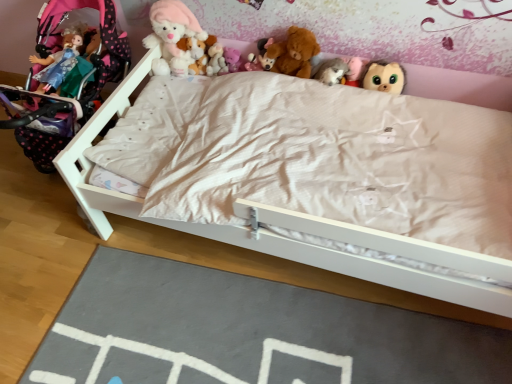
The width and height of the screenshot is (512, 384). I want to click on vacant point above slate at lower center (from a real-world perspective), so click(252, 337).